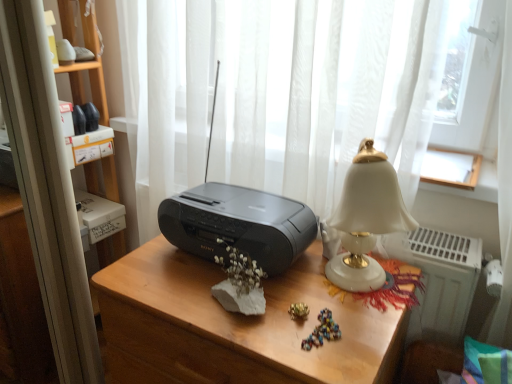
The height and width of the screenshot is (384, 512). Find the location of `free space in front of white porcelain lamp at right`. free space in front of white porcelain lamp at right is located at coordinates click(335, 344).